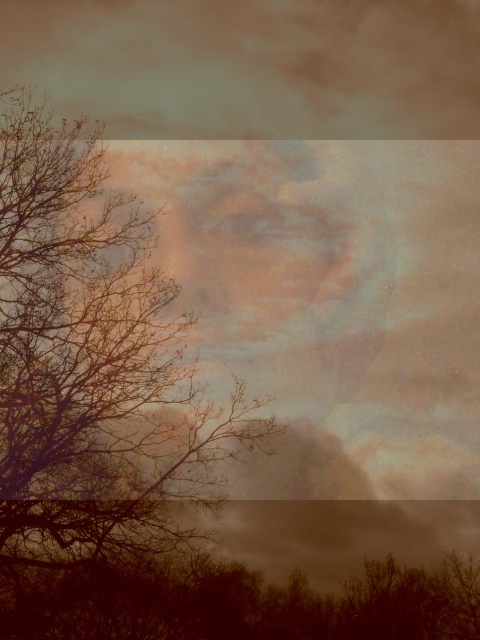
Question: Does brown leafless branches at left appear on the left side of brown matte tree at lower center?

Choices:
 (A) no
 (B) yes

Answer: (B)

Question: Which object is farther from the camera taking this photo?

Choices:
 (A) brown leafless branches at left
 (B) brown matte tree at lower center

Answer: (A)

Question: Considering the relative positions of brown leafless branches at left and brown matte tree at lower center in the image provided, where is brown leafless branches at left located with respect to brown matte tree at lower center?

Choices:
 (A) below
 (B) above

Answer: (B)

Question: Is brown leafless branches at left thinner than brown matte tree at lower center?

Choices:
 (A) yes
 (B) no

Answer: (A)

Question: Which point is farther to the camera?

Choices:
 (A) brown leafless branches at left
 (B) brown matte tree at lower center

Answer: (A)